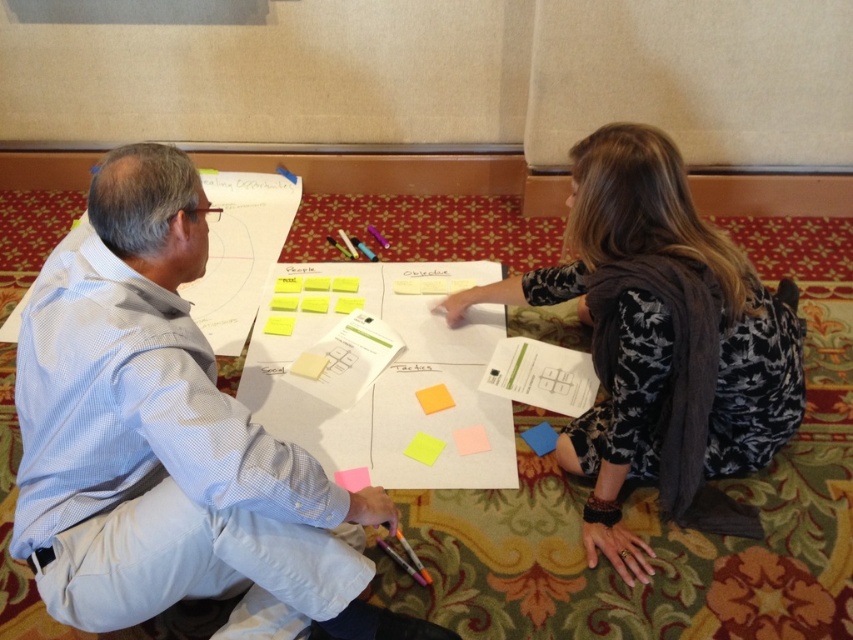
Based on the photo, you are an observer looking at the scene. You see two papers on the floor between the two people. The yellow paper at center and the pink paper at center. Which paper is positioned higher up compared to the other?

The yellow paper at center is located above the pink paper at center, so the yellow paper is positioned higher up.